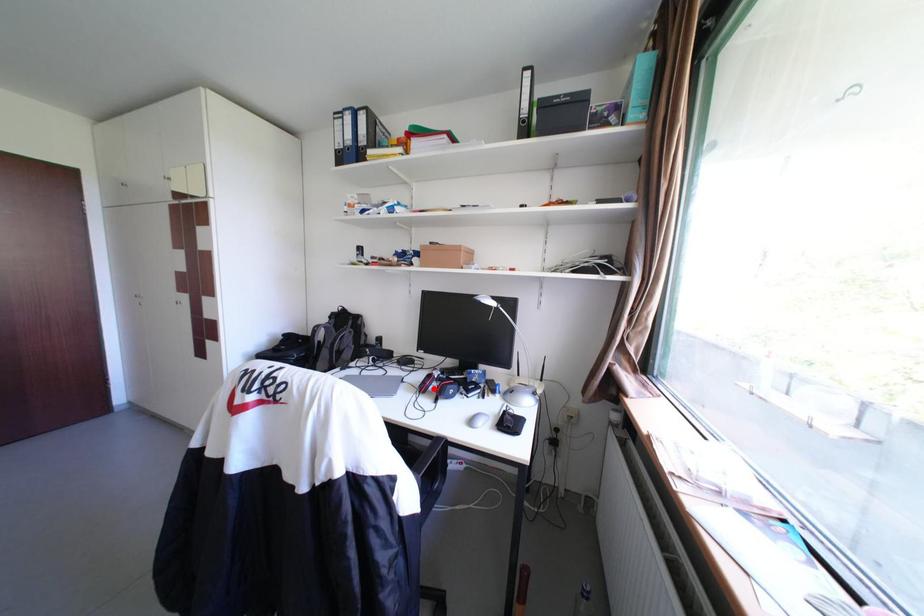
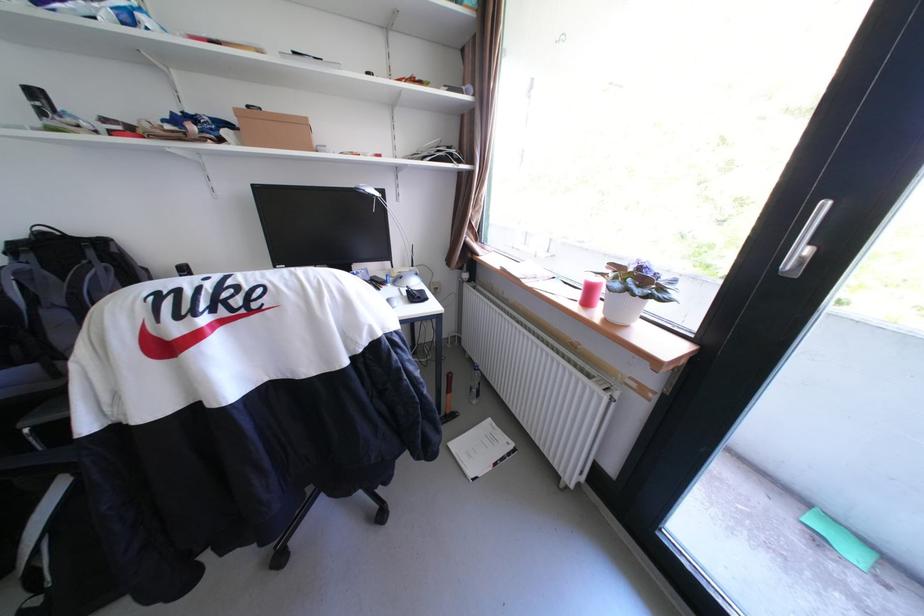
Question: I am providing you with two images of the same scene from different viewpoints. A red point is marked on the first image. Is the red point's position out of view in image 2?

Choices:
 (A) Yes
 (B) No

Answer: (A)